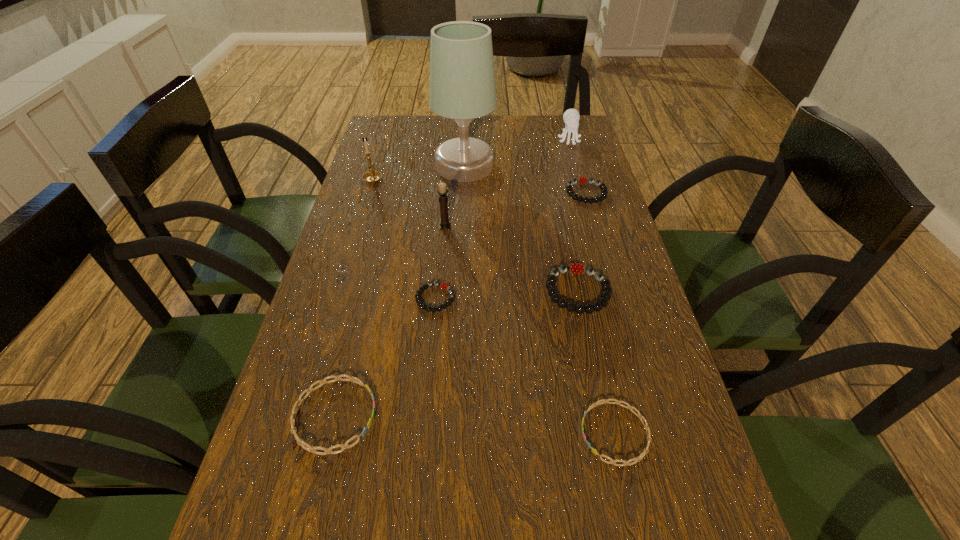
The image size is (960, 540). I want to click on object at the far edge, so click(x=571, y=117).

The image size is (960, 540). I want to click on candle holder that is at the left edge, so click(371, 176).

Identify the location of bracelet that is at the left edge. (312, 449).

The width and height of the screenshot is (960, 540). Identify the location of octopus that is at the right edge. (571, 117).

Where is `object at the far right corner`? The width and height of the screenshot is (960, 540). object at the far right corner is located at coordinates (571, 117).

This screenshot has width=960, height=540. In the image, there is a desktop. Identify the location of vacant space at the far edge. (530, 148).

Identify the location of free spot at the left edge of the desktop. (385, 187).

Where is `vacant space at the right edge of the desktop`? This screenshot has width=960, height=540. vacant space at the right edge of the desktop is located at coordinates (596, 422).

I want to click on vacant space at the far left corner of the desktop, so click(x=374, y=123).

Identify the location of vacant space at the far right corner. (557, 142).